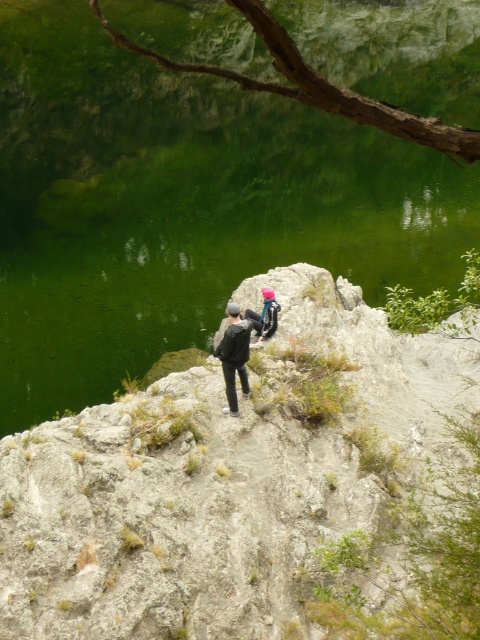
Can you confirm if gray rocky hillside at center is bigger than pink fabric backpack at center?

Yes, gray rocky hillside at center is bigger than pink fabric backpack at center.

Between gray rocky hillside at center and pink fabric backpack at center, which one is positioned lower?

Positioned lower is gray rocky hillside at center.

Where is `gray rocky hillside at center`? The image size is (480, 640). gray rocky hillside at center is located at coordinates (259, 490).

Which of these two, gray rocky hillside at center or dark gray fabric jacket at center, stands taller?

gray rocky hillside at center is taller.

Can you confirm if gray rocky hillside at center is smaller than dark gray fabric jacket at center?

No, gray rocky hillside at center is not smaller than dark gray fabric jacket at center.

This screenshot has width=480, height=640. Find the location of `gray rocky hillside at center`. gray rocky hillside at center is located at coordinates (259, 490).

The height and width of the screenshot is (640, 480). I want to click on gray rocky hillside at center, so click(259, 490).

Can you confirm if dark gray fabric jacket at center is smaller than pink fabric backpack at center?

Actually, dark gray fabric jacket at center might be larger than pink fabric backpack at center.

Where is `dark gray fabric jacket at center`? The width and height of the screenshot is (480, 640). dark gray fabric jacket at center is located at coordinates (235, 355).